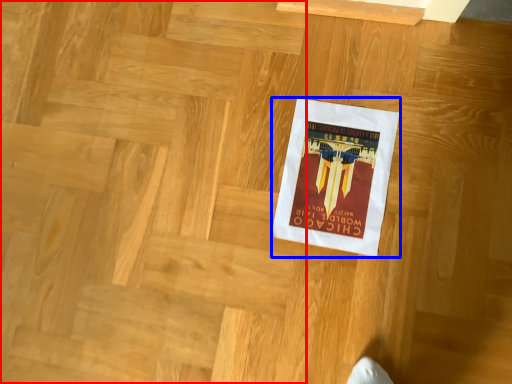
Question: Which object appears closest to the camera in this image, stairwell (highlighted by a red box) or poster (highlighted by a blue box)?

Choices:
 (A) stairwell
 (B) poster

Answer: (A)